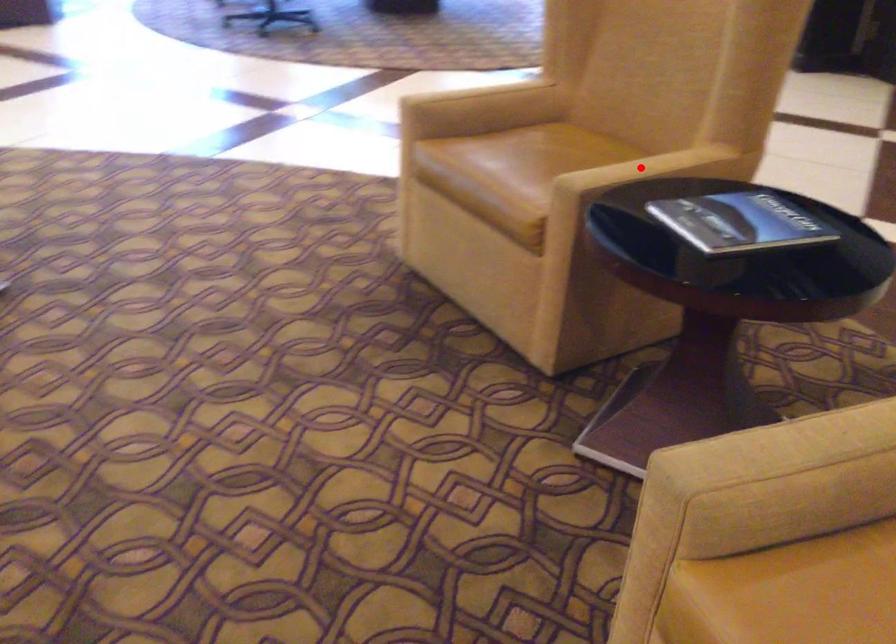
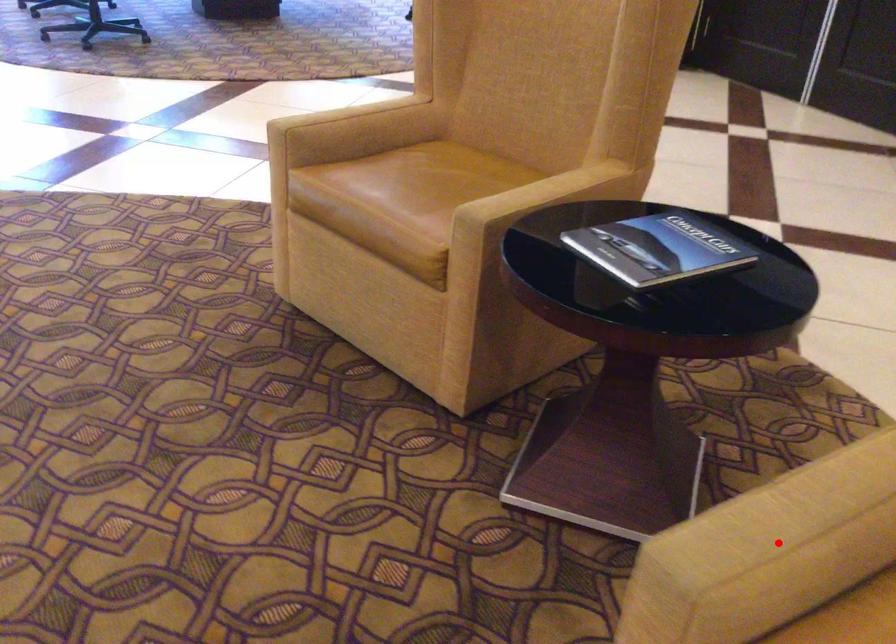
I am providing you with two images of the same scene from different viewpoints. A red point is marked on the first image and another point is marked on the second image. Are the points marked in image1 and image2 representing the same 3D position?

No